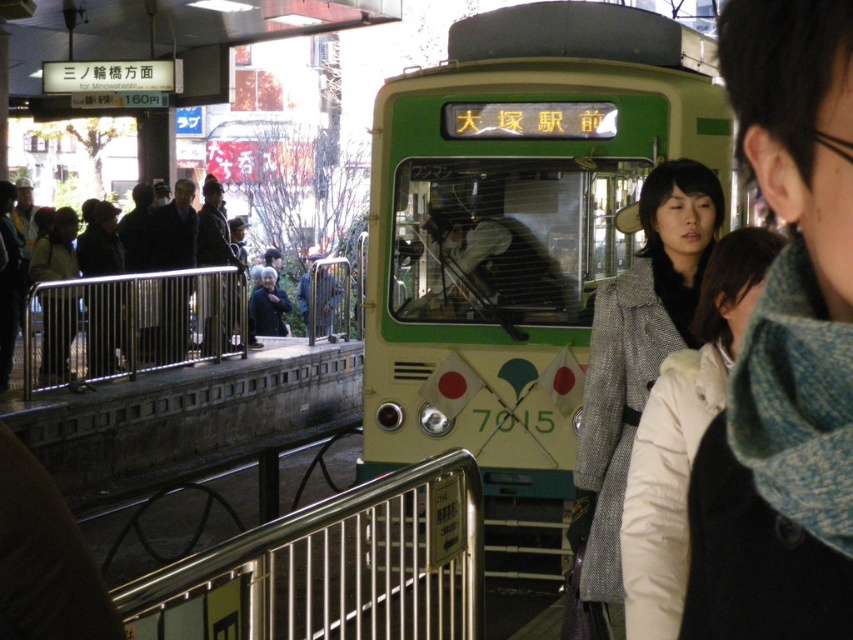
Question: Among these objects, which one is nearest to the camera?

Choices:
 (A) white wool coat at center
 (B) gray wool coat at center
 (C) blue knit scarf at center
 (D) dark brown coat at center

Answer: (C)

Question: Observing the image, what is the correct spatial positioning of blue knit scarf at center in reference to dark gray fabric jacket at center?

Choices:
 (A) left
 (B) right

Answer: (B)

Question: Is satin silver railing at left thinner than dark brown coat at center?

Choices:
 (A) no
 (B) yes

Answer: (A)

Question: Among these points, which one is nearest to the camera?

Choices:
 (A) (828, 54)
 (B) (641, 285)
 (C) (730, 276)

Answer: (A)

Question: Considering the real-world distances, which object is farthest from the dark brown coat at center?

Choices:
 (A) white wool coat at center
 (B) gray wool coat at center
 (C) green matte bus at center

Answer: (A)

Question: Does blue knit scarf at center have a greater width compared to satin silver railing at left?

Choices:
 (A) yes
 (B) no

Answer: (B)